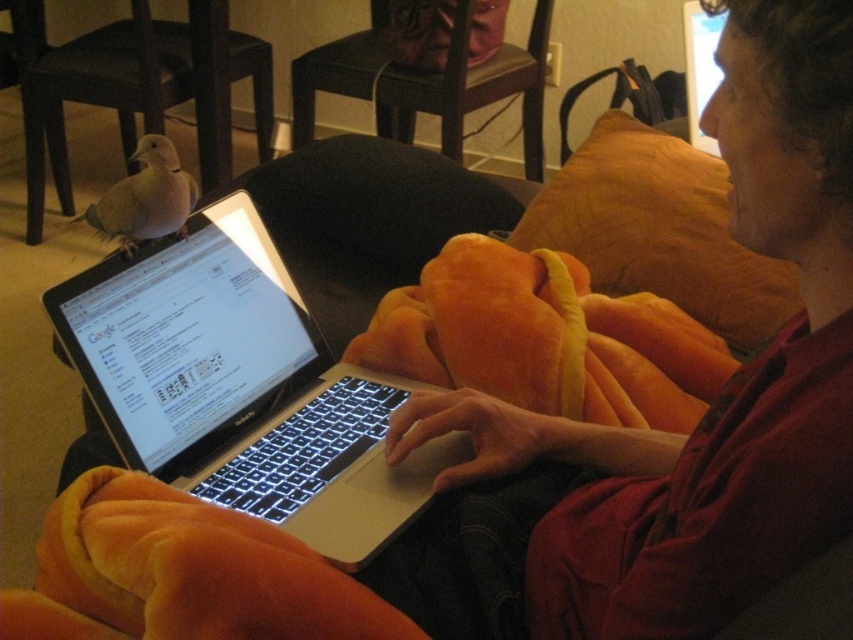
Question: Which point is closer to the camera?

Choices:
 (A) (726, 301)
 (B) (206, 252)
 (C) (155, 150)
 (D) (525, 65)

Answer: (C)

Question: Is orange plush pillow at upper right to the right of dark wood chair at upper center from the viewer's perspective?

Choices:
 (A) no
 (B) yes

Answer: (B)

Question: Which object is farther from the camera taking this photo?

Choices:
 (A) dark wood chair at upper center
 (B) orange plush pillow at upper right
 (C) brown feathered bird at lower left

Answer: (A)

Question: Can you confirm if matte orange blanket at lower left is wider than brown feathered bird at lower left?

Choices:
 (A) yes
 (B) no

Answer: (A)

Question: Observing the image, what is the correct spatial positioning of silver metallic laptop at center in reference to matte orange blanket at lower left?

Choices:
 (A) above
 (B) below

Answer: (B)

Question: Which object is closer to the camera taking this photo?

Choices:
 (A) brown feathered bird at lower left
 (B) dark wood chair at upper center

Answer: (A)